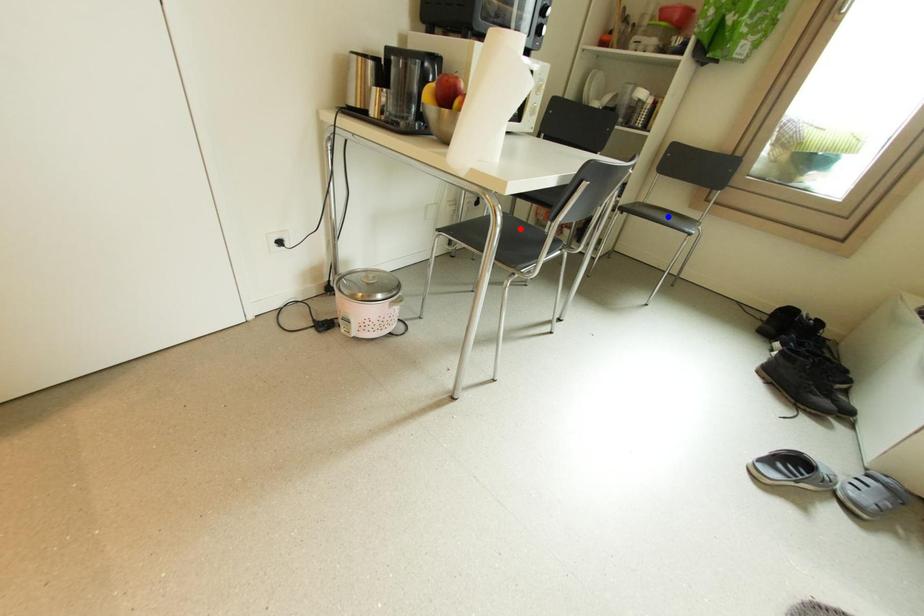
Question: Which of the two points in the image is closer to the camera?

Choices:
 (A) Blue point is closer.
 (B) Red point is closer.

Answer: (B)